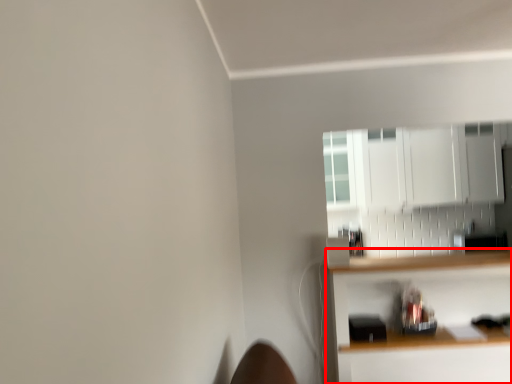
Question: From the image's perspective, where is shelf (annotated by the red box) located relative to cabinetry?

Choices:
 (A) above
 (B) below

Answer: (B)